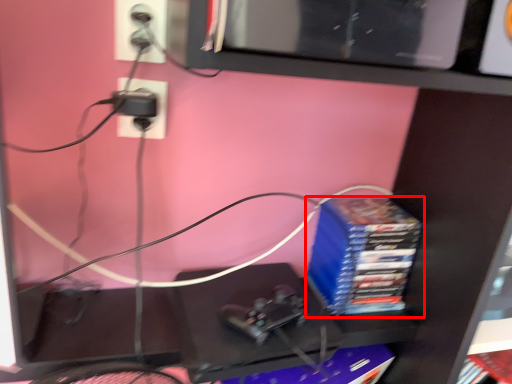
Question: In this image, where is paperback book (annotated by the red box) located relative to paperback book?

Choices:
 (A) left
 (B) right

Answer: (B)